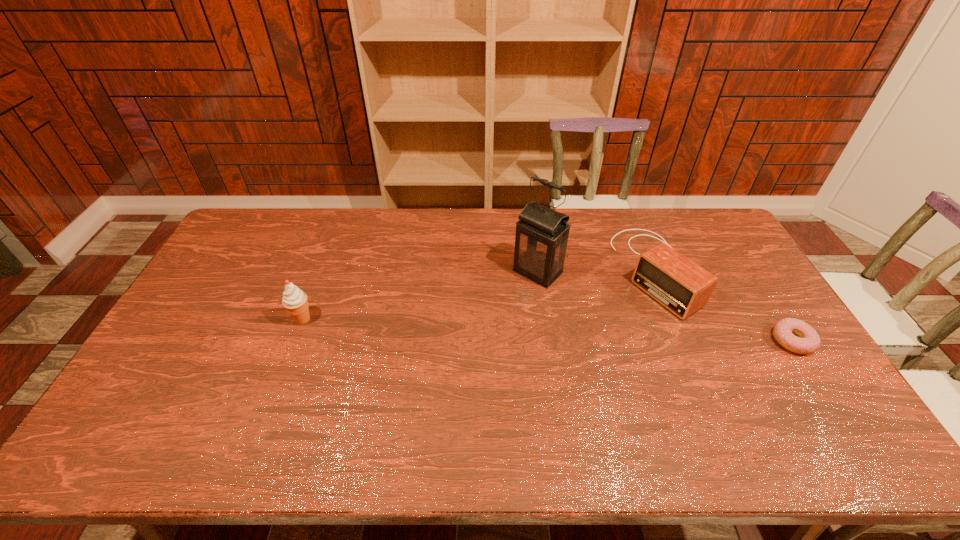
This screenshot has height=540, width=960. In order to click on blank space located on the front-facing side of the second object from left to right in this screenshot , I will do `click(466, 340)`.

Find the location of a particular element. vacant space situated on the front-facing side of the second object from left to right is located at coordinates (449, 355).

Where is `free region located 0.330m on the front-facing side of the second object from left to right`? The width and height of the screenshot is (960, 540). free region located 0.330m on the front-facing side of the second object from left to right is located at coordinates (457, 348).

Where is `free spot located on the front-facing side of the second shortest object`? The width and height of the screenshot is (960, 540). free spot located on the front-facing side of the second shortest object is located at coordinates (553, 347).

Find the location of `vacant space located on the front-facing side of the second shortest object`. vacant space located on the front-facing side of the second shortest object is located at coordinates (608, 314).

Identify the location of vacant position located 0.230m on the front-facing side of the second shortest object. (582, 330).

You are a GUI agent. You are given a task and a screenshot of the screen. Output one action in this format:
    pyautogui.click(x=<x>, y=<y>)
    Task: Click on the object that is at the far edge
    
    Given the screenshot: What is the action you would take?
    pyautogui.click(x=683, y=287)

Image resolution: width=960 pixels, height=540 pixels. I want to click on object situated at the right edge, so click(x=808, y=340).

This screenshot has height=540, width=960. I want to click on vacant space at the far edge, so click(x=391, y=224).

At what (x,y) coordinates should I click in order to perform the action: click on free space at the near edge. Please return your answer as a coordinate pair (x, y). The image size is (960, 540). Looking at the image, I should click on (466, 391).